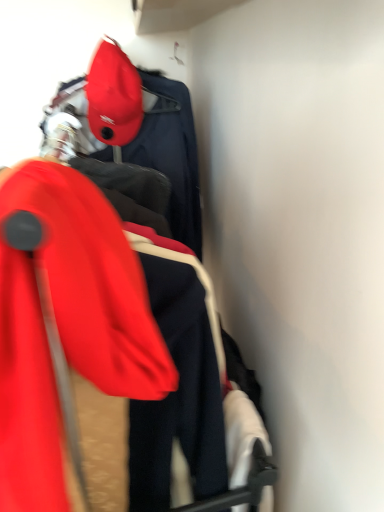
Where is `matte red ski jacket at left`? Image resolution: width=384 pixels, height=512 pixels. matte red ski jacket at left is located at coordinates (65, 321).

What do you see at coordinates (65, 321) in the screenshot?
I see `matte red ski jacket at left` at bounding box center [65, 321].

Where is `matte red cap at upper left`? This screenshot has height=512, width=384. matte red cap at upper left is located at coordinates (113, 95).

What do you see at coordinates (113, 95) in the screenshot? I see `matte red cap at upper left` at bounding box center [113, 95].

From the picture: Measure the distance between matte red cap at upper left and camera.

A distance of 3.39 feet exists between matte red cap at upper left and camera.

At what (x,y) coordinates should I click in order to perform the action: click on matte red ski jacket at left. Please return your answer as a coordinate pair (x, y). The image size is (384, 512). Looking at the image, I should click on (65, 321).

From the picture: Is matte red cap at upper left at the right side of matte red ski jacket at left?

No, matte red cap at upper left is not to the right of matte red ski jacket at left.

Between matte red cap at upper left and matte red ski jacket at left, which one is positioned behind?

Positioned behind is matte red cap at upper left.

Does point (111, 117) appear closer or farther from the camera than point (8, 207)?

Point (111, 117).

From the image's perspective, is matte red cap at upper left on top of matte red ski jacket at left?

Yes, from the image's perspective, matte red cap at upper left is on top of matte red ski jacket at left.

Consider the image. From a real-world perspective, is matte red cap at upper left positioned over matte red ski jacket at left based on gravity?

Yes, from a real-world perspective, matte red cap at upper left is on top of matte red ski jacket at left.

Between matte red cap at upper left and matte red ski jacket at left, which one has smaller width?

matte red cap at upper left is thinner.

Considering the relative sizes of matte red cap at upper left and matte red ski jacket at left in the image provided, is matte red cap at upper left shorter than matte red ski jacket at left?

Yes.

In terms of size, does matte red cap at upper left appear bigger or smaller than matte red ski jacket at left?

matte red cap at upper left is smaller than matte red ski jacket at left.

Which is correct: matte red cap at upper left is inside matte red ski jacket at left, or outside of it?

matte red cap at upper left is not inside matte red ski jacket at left, it's outside.

Is matte red cap at upper left far away from matte red ski jacket at left?

That's not correct — matte red cap at upper left is a little close to matte red ski jacket at left.

Is matte red cap at upper left oriented towards matte red ski jacket at left?

No, matte red cap at upper left is not oriented towards matte red ski jacket at left.

From the picture: How much distance is there between matte red cap at upper left and matte red ski jacket at left?

matte red cap at upper left and matte red ski jacket at left are 29.99 inches apart.

I want to click on ski jacket beneath the matte red cap at upper left (from a real-world perspective), so click(x=65, y=321).

Considering the positions of objects matte red ski jacket at left and matte red cap at upper left in the image provided, who is more to the right, matte red ski jacket at left or matte red cap at upper left?

Positioned to the right is matte red ski jacket at left.

Considering the positions of objects matte red ski jacket at left and matte red cap at upper left in the image provided, who is behind, matte red ski jacket at left or matte red cap at upper left?

matte red cap at upper left is behind.

Is point (147, 380) positioned in front of point (127, 103)?

That is True.

From the image's perspective, between matte red ski jacket at left and matte red cap at upper left, who is located below?

matte red ski jacket at left, from the image's perspective.

From the picture: From a real-world perspective, between matte red ski jacket at left and matte red cap at upper left, who is vertically lower?

matte red ski jacket at left.

Does matte red ski jacket at left have a lesser width compared to matte red cap at upper left?

No, matte red ski jacket at left is not thinner than matte red cap at upper left.

In terms of height, does matte red ski jacket at left look taller or shorter compared to matte red cap at upper left?

Clearly, matte red ski jacket at left is taller compared to matte red cap at upper left.

Which of these two, matte red ski jacket at left or matte red cap at upper left, is smaller?

matte red cap at upper left is smaller.

Is matte red ski jacket at left positioned beyond the bounds of matte red cap at upper left?

Absolutely, matte red ski jacket at left is external to matte red cap at upper left.

Are matte red ski jacket at left and matte red cap at upper left making contact?

No, matte red ski jacket at left is not making contact with matte red cap at upper left.

From the picture: Is matte red ski jacket at left facing towards matte red cap at upper left?

No, matte red ski jacket at left is not aimed at matte red cap at upper left.

How many degrees apart are the facing directions of matte red ski jacket at left and matte red cap at upper left?

matte red ski jacket at left and matte red cap at upper left are facing 0.00151 degrees away from each other.

Identify the location of hat above the matte red ski jacket at left (from the image's perspective). (113, 95).

Find the location of a particular element. ski jacket in front of the matte red cap at upper left is located at coordinates (65, 321).

The image size is (384, 512). I want to click on hat that is behind the matte red ski jacket at left, so click(x=113, y=95).